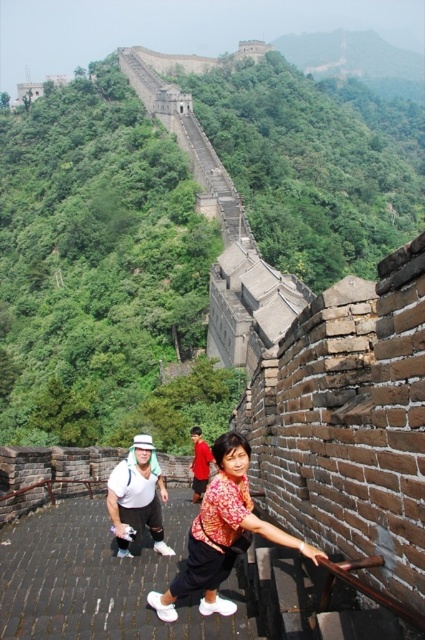
Does matte red blouse at center have a greater width compared to white matte hat at upper center?

Incorrect, matte red blouse at center's width does not surpass white matte hat at upper center's.

Consider the image. Can you confirm if matte red blouse at center is taller than white matte hat at upper center?

Indeed, matte red blouse at center has a greater height compared to white matte hat at upper center.

Between point (210, 538) and point (159, 515), which one is positioned in front?

Positioned in front is point (210, 538).

Identify the location of matte red blouse at center. (221, 534).

Can you confirm if matte red blouse at center is positioned above red shirt at center?

Correct, matte red blouse at center is located above red shirt at center.

Between point (223, 490) and point (212, 456), which one is positioned behind?

The point (212, 456) is behind.

The width and height of the screenshot is (425, 640). I want to click on matte red blouse at center, so click(x=221, y=534).

Can you confirm if white matte hat at upper center is positioned to the left of red shirt at center?

Indeed, white matte hat at upper center is positioned on the left side of red shirt at center.

Is point (147, 448) more distant than point (204, 444)?

No, it is in front of (204, 444).

Find the location of a particular element. This screenshot has height=640, width=425. white matte hat at upper center is located at coordinates (136, 497).